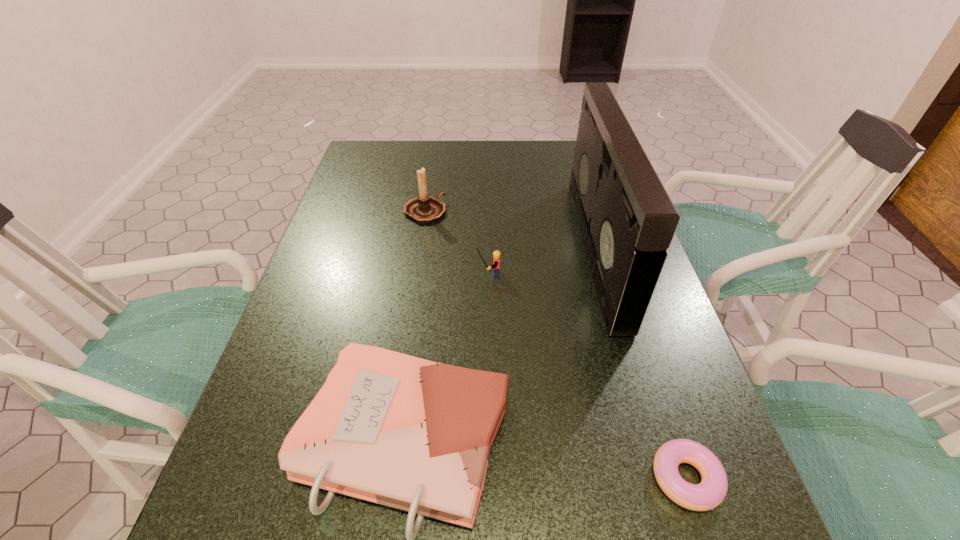
At what (x,y) coordinates should I click in order to perform the action: click on free space between the videotape and the candle holder. Please return your answer as a coordinate pair (x, y). The width and height of the screenshot is (960, 540). Looking at the image, I should click on (511, 231).

Where is `empty space between the candle holder and the Lego`? The width and height of the screenshot is (960, 540). empty space between the candle holder and the Lego is located at coordinates (457, 242).

Locate an element on the screen. This screenshot has width=960, height=540. vacant area that lies between the doughnut and the fourth shortest object is located at coordinates (556, 345).

The image size is (960, 540). Find the location of `empty location between the videotape and the third tallest object`. empty location between the videotape and the third tallest object is located at coordinates (542, 261).

You are a GUI agent. You are given a task and a screenshot of the screen. Output one action in this format:
    pyautogui.click(x=<x>, y=<y>)
    Task: Click on the free spot between the tallest object and the third tallest object
    The width and height of the screenshot is (960, 540).
    Given the screenshot: What is the action you would take?
    pyautogui.click(x=542, y=261)

You are a GUI agent. You are given a task and a screenshot of the screen. Output one action in this format:
    pyautogui.click(x=<x>, y=<y>)
    Task: Click on the object that is the second nearest to the second tallest object
    The height and width of the screenshot is (540, 960).
    Given the screenshot: What is the action you would take?
    pyautogui.click(x=627, y=220)

Locate which object ranks second in proximity to the phonebook. Please provide its 2D coordinates. Your answer should be formatted as a tuple, i.e. [(x, y)], where the tuple contains the x and y coordinates of a point satisfying the conditions above.

[(711, 491)]

I want to click on free space that satisfies the following two spatial constraints: 1. on the front-facing side of the third tallest object; 2. on the back side of the shortest object, so click(492, 478).

Find the location of `vacant region that satisfies the following two spatial constraints: 1. on the front-facing side of the shortest object; 2. on the right side of the third shortest object`. vacant region that satisfies the following two spatial constraints: 1. on the front-facing side of the shortest object; 2. on the right side of the third shortest object is located at coordinates (492, 478).

You are a GUI agent. You are given a task and a screenshot of the screen. Output one action in this format:
    pyautogui.click(x=<x>, y=<y>)
    Task: Click on the free space that satisfies the following two spatial constraints: 1. on the front side of the videotape; 2. on the back side of the doughnut
    
    Given the screenshot: What is the action you would take?
    pyautogui.click(x=663, y=478)